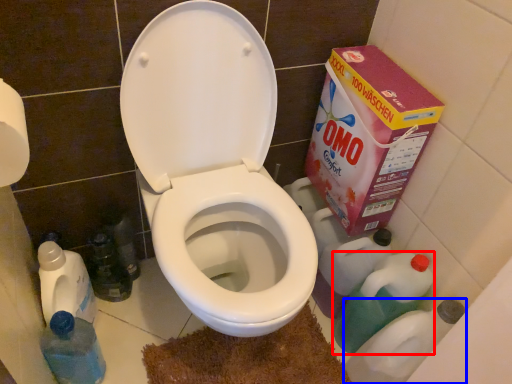
Question: Which object appears closest to the camera in this image, cleaning product (highlighted by a red box) or cleaning product (highlighted by a blue box)?

Choices:
 (A) cleaning product
 (B) cleaning product

Answer: (B)